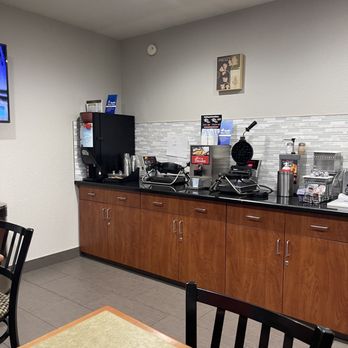
Identify the location of drawer pulls. (92, 192), (121, 197), (160, 203), (200, 209), (251, 218), (323, 228).